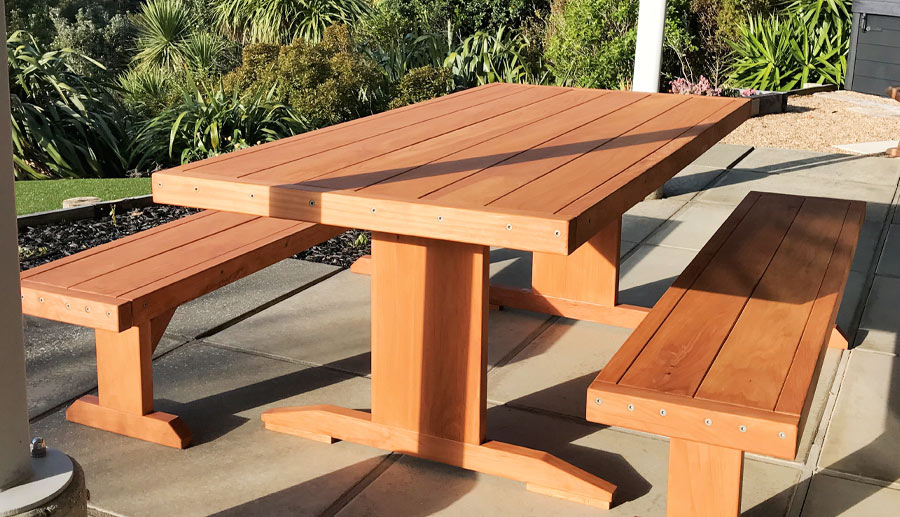
Locate an element on the screen. white beam is located at coordinates (649, 22).